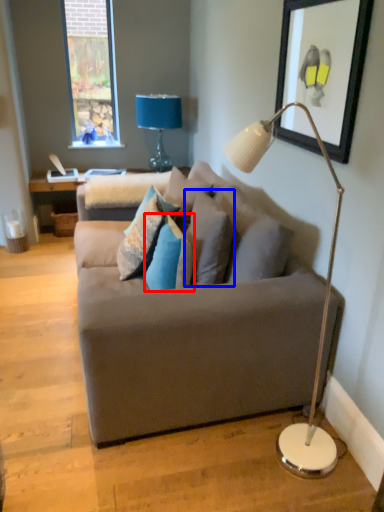
Question: Which object is further to the camera taking this photo, pillow (highlighted by a red box) or pillow (highlighted by a blue box)?

Choices:
 (A) pillow
 (B) pillow

Answer: (B)